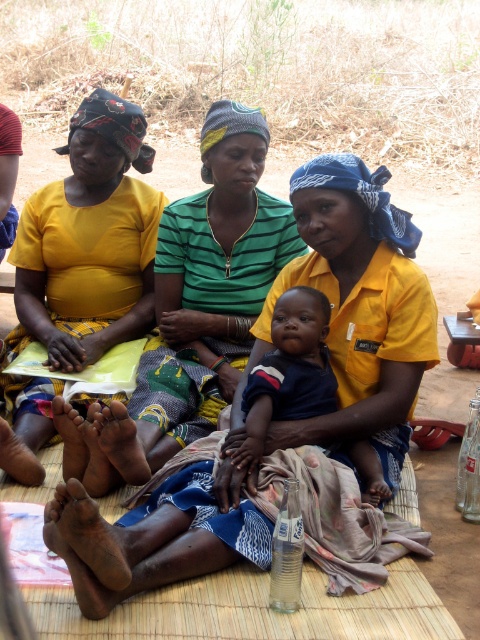
Does yellow fabric at upper left appear on the left side of dark blue cotton shirt at center?

Indeed, yellow fabric at upper left is positioned on the left side of dark blue cotton shirt at center.

Is point (239, 225) positioned in front of point (283, 396)?

That is False.

This screenshot has height=640, width=480. Find the location of `yellow fabric at upper left`. yellow fabric at upper left is located at coordinates (192, 310).

Which is below, yellow fabric at upper left or yellow fabric at left?

Positioned lower is yellow fabric at upper left.

Does yellow fabric at upper left appear on the left side of yellow fabric at left?

No, yellow fabric at upper left is not to the left of yellow fabric at left.

Is point (212, 401) farther from viewer compared to point (127, 221)?

That is False.

Locate an element on the screen. yellow fabric at upper left is located at coordinates (192, 310).

Can you confirm if yellow fabric at left is positioned to the left of dark blue cotton shirt at center?

Yes, yellow fabric at left is to the left of dark blue cotton shirt at center.

Is yellow fabric at left further to camera compared to dark blue cotton shirt at center?

That is True.

Which is in front, point (88, 144) or point (276, 346)?

Point (276, 346) is in front.

The width and height of the screenshot is (480, 640). I want to click on yellow fabric at left, so click(88, 241).